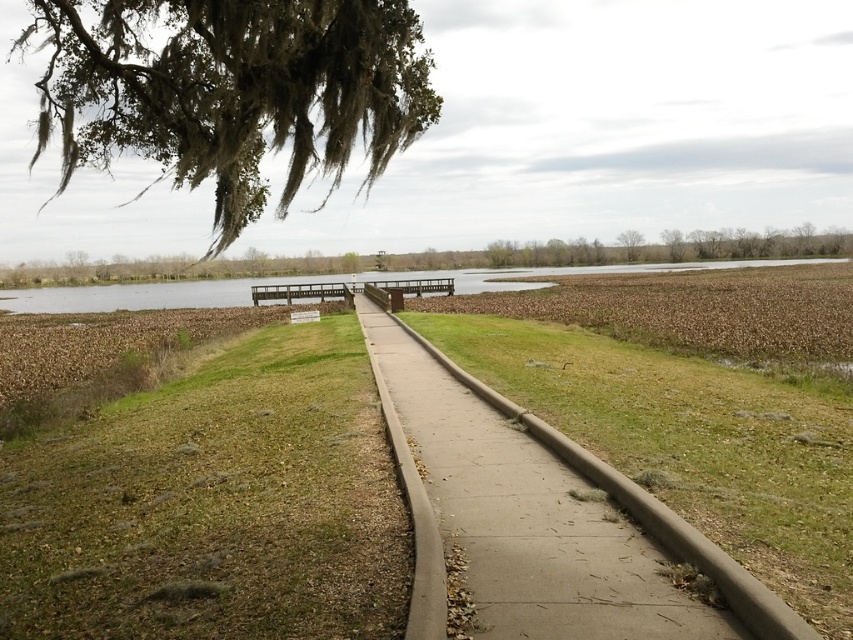
Question: Which point is farther to the camera?

Choices:
 (A) concrete sidewalk at center
 (B) green leafy tree at upper center

Answer: (B)

Question: In this image, where is concrete sidewalk at center located relative to green grass at center?

Choices:
 (A) right
 (B) left

Answer: (A)

Question: Which object appears closest to the camera in this image?

Choices:
 (A) green leafy tree at upper center
 (B) green grass at center
 (C) green mossy tree at upper right
 (D) concrete sidewalk at center

Answer: (D)

Question: Is green grass at center below green leafy tree at upper center?

Choices:
 (A) no
 (B) yes

Answer: (B)

Question: Is green grass at center below concrete at center?

Choices:
 (A) yes
 (B) no

Answer: (A)

Question: Which object appears closest to the camera in this image?

Choices:
 (A) green mossy branches at upper left
 (B) green mossy tree at upper right
 (C) concrete at center

Answer: (C)